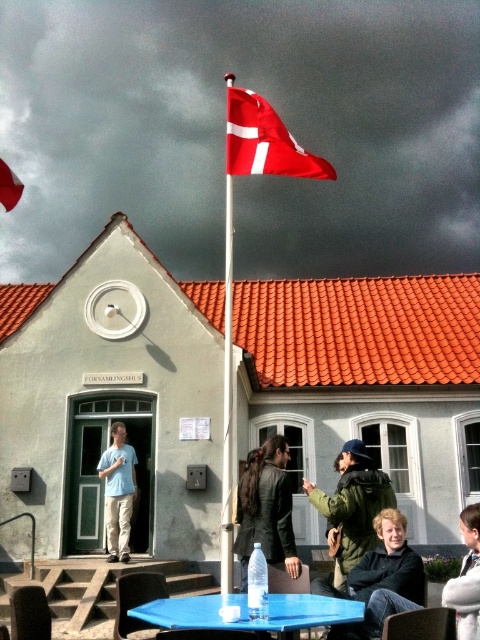
Is red fabric flag at center to the right of metallic flag pole at center from the viewer's perspective?

Indeed, red fabric flag at center is positioned on the right side of metallic flag pole at center.

Is red fabric flag at center bigger than metallic flag pole at center?

Indeed, red fabric flag at center has a larger size compared to metallic flag pole at center.

Does point (256, 173) lie behind point (231, 355)?

No, it is not.

This screenshot has height=640, width=480. In order to click on red fabric flag at center in this screenshot , I will do `click(264, 141)`.

Does point (357, 616) lie behind point (4, 188)?

No.

Can you confirm if blue plastic table at center is positioned below red fabric flag at upper center?

Yes.

Is point (278, 612) closer to camera compared to point (7, 172)?

Yes, point (278, 612) is closer to viewer.

In order to click on blue plastic table at center in this screenshot , I will do `click(247, 611)`.

Does green matte jacket at center appear on the right side of matte black jacket at lower right?

Indeed, green matte jacket at center is positioned on the right side of matte black jacket at lower right.

Is green matte jacket at center shorter than matte black jacket at lower right?

Yes.

Who is more distant from viewer, (345, 454) or (382, 516)?

The point (345, 454) is behind.

Locate an element on the screen. green matte jacket at center is located at coordinates (351, 508).